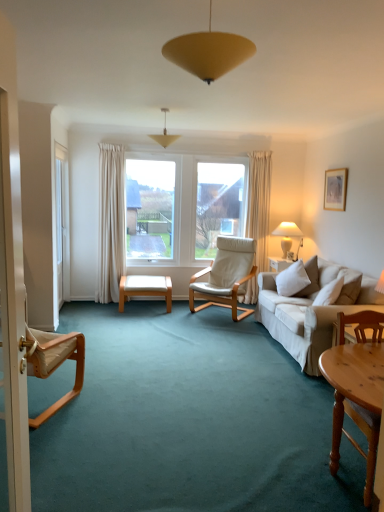
Question: Is white ceramic lamp at right, the third lamp viewed from the front, positioned behind matte white picture frame at upper right?

Choices:
 (A) no
 (B) yes

Answer: (B)

Question: From a real-world perspective, does white ceramic lamp at right, the third lamp viewed from the front, sit lower than matte white picture frame at upper right?

Choices:
 (A) no
 (B) yes

Answer: (B)

Question: Does white ceramic lamp at right, the first lamp ordered from the bottom, have a lesser height compared to matte white picture frame at upper right?

Choices:
 (A) yes
 (B) no

Answer: (A)

Question: Can we say white ceramic lamp at right, the third lamp viewed from the front, lies outside matte white picture frame at upper right?

Choices:
 (A) yes
 (B) no

Answer: (A)

Question: From the image's perspective, is white ceramic lamp at right, the first lamp ordered from the bottom, located above matte white picture frame at upper right?

Choices:
 (A) yes
 (B) no

Answer: (B)

Question: Does white ceramic lamp at right, the first lamp ordered from the bottom, touch matte white picture frame at upper right?

Choices:
 (A) yes
 (B) no

Answer: (B)

Question: Is matte white picture frame at upper right next to white plastic screen door at left?

Choices:
 (A) no
 (B) yes

Answer: (A)

Question: Could you tell me if matte white picture frame at upper right is facing white plastic screen door at left?

Choices:
 (A) yes
 (B) no

Answer: (A)

Question: Can you confirm if matte white picture frame at upper right is thinner than white plastic screen door at left?

Choices:
 (A) yes
 (B) no

Answer: (A)

Question: Is matte white picture frame at upper right bigger than white plastic screen door at left?

Choices:
 (A) yes
 (B) no

Answer: (B)

Question: From the image's perspective, is matte white picture frame at upper right over white plastic screen door at left?

Choices:
 (A) no
 (B) yes

Answer: (B)

Question: Can you confirm if matte white picture frame at upper right is wider than white plastic screen door at left?

Choices:
 (A) yes
 (B) no

Answer: (B)

Question: Is matte yellow cone at center, marked as the 2th lamp in a front-to-back arrangement, directly adjacent to beige fabric chair at left, the third chair in the right-to-left sequence?

Choices:
 (A) yes
 (B) no

Answer: (B)